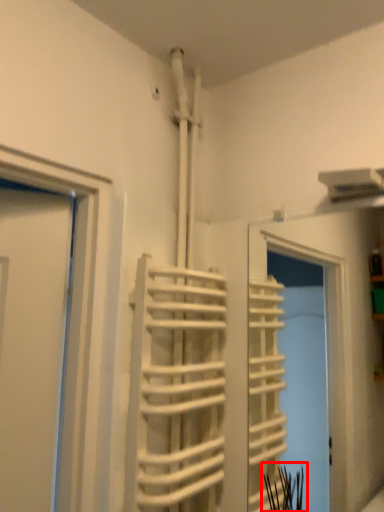
Question: From the image, what is the correct spatial relationship of plant (annotated by the red box) in relation to stair?

Choices:
 (A) right
 (B) left

Answer: (A)